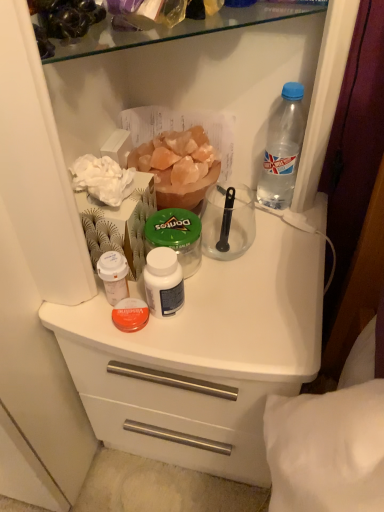
The width and height of the screenshot is (384, 512). Find the location of `free space in front of transparent plastic spoon at center`. free space in front of transparent plastic spoon at center is located at coordinates (235, 307).